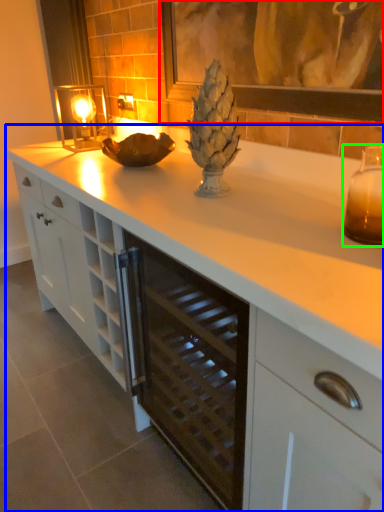
Question: Which is nearer to the picture frame (highlighted by a red box)? countertop (highlighted by a blue box) or candle holder (highlighted by a green box).

Choices:
 (A) countertop
 (B) candle holder

Answer: (B)